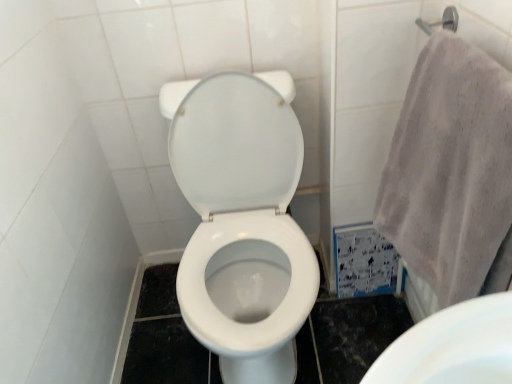
In order to click on gray cotton towel at right in this screenshot , I will do `click(451, 175)`.

This screenshot has width=512, height=384. Describe the element at coordinates (451, 175) in the screenshot. I see `gray cotton towel at right` at that location.

Identify the location of white glossy toilet at center. (242, 221).

The height and width of the screenshot is (384, 512). Describe the element at coordinates (242, 221) in the screenshot. I see `white glossy toilet at center` at that location.

Identify the location of gray cotton towel at right. This screenshot has height=384, width=512. (451, 175).

Considering the relative positions of gray cotton towel at right and white glossy toilet at center in the image provided, is gray cotton towel at right to the left or to the right of white glossy toilet at center?

gray cotton towel at right is positioned on white glossy toilet at center's right side.

Which object is further away from the camera taking this photo, gray cotton towel at right or white glossy toilet at center?

white glossy toilet at center is more distant.

Is point (496, 104) closer or farther from the camera than point (272, 272)?

Point (496, 104) appears to be closer to the viewer than point (272, 272).

From the image's perspective, is gray cotton towel at right located beneath white glossy toilet at center?

Incorrect, from the image's perspective, gray cotton towel at right is higher than white glossy toilet at center.

From a real-world perspective, is gray cotton towel at right located beneath white glossy toilet at center?

Incorrect, from a real-world perspective, gray cotton towel at right is higher than white glossy toilet at center.

Between gray cotton towel at right and white glossy toilet at center, which one has smaller width?

With smaller width is gray cotton towel at right.

Between gray cotton towel at right and white glossy toilet at center, which one has more height?

With more height is white glossy toilet at center.

Who is bigger, gray cotton towel at right or white glossy toilet at center?

white glossy toilet at center.

Which is correct: gray cotton towel at right is inside white glossy toilet at center, or outside of it?

gray cotton towel at right is spatially situated outside white glossy toilet at center.

Does gray cotton towel at right touch white glossy toilet at center?

No.

Could you tell me if gray cotton towel at right is facing white glossy toilet at center?

Yes, gray cotton towel at right is oriented towards white glossy toilet at center.

Can you tell me how much gray cotton towel at right and white glossy toilet at center differ in facing direction?

They differ by 89.5 degrees in their facing directions.

How much distance is there between gray cotton towel at right and white glossy toilet at center?

gray cotton towel at right is 15.87 inches from white glossy toilet at center.

Where is `bath towel above the white glossy toilet at center (from a real-world perspective)`? This screenshot has height=384, width=512. bath towel above the white glossy toilet at center (from a real-world perspective) is located at coordinates (451, 175).

Which is more to the right, white glossy toilet at center or gray cotton towel at right?

gray cotton towel at right is more to the right.

Who is more distant, white glossy toilet at center or gray cotton towel at right?

white glossy toilet at center is further from the camera.

Does point (258, 126) lie behind point (426, 83)?

Yes, it is behind point (426, 83).

From the image's perspective, is white glossy toilet at center below gray cotton towel at right?

Yes, from the image's perspective, white glossy toilet at center is below gray cotton towel at right.

From a real-world perspective, who is located higher, white glossy toilet at center or gray cotton towel at right?

gray cotton towel at right.

Between white glossy toilet at center and gray cotton towel at right, which one has smaller width?

gray cotton towel at right is thinner.

Is white glossy toilet at center shorter than gray cotton towel at right?

In fact, white glossy toilet at center may be taller than gray cotton towel at right.

Can you confirm if white glossy toilet at center is smaller than gray cotton towel at right?

Actually, white glossy toilet at center might be larger than gray cotton towel at right.

Consider the image. Is white glossy toilet at center outside of gray cotton towel at right?

Yes.

Is white glossy toilet at center next to gray cotton towel at right and touching it?

They are not placed beside each other.

Could you tell me if white glossy toilet at center is facing gray cotton towel at right?

No, white glossy toilet at center is not aimed at gray cotton towel at right.

How distant is white glossy toilet at center from gray cotton towel at right?

The distance of white glossy toilet at center from gray cotton towel at right is 15.87 inches.

You are a GUI agent. You are given a task and a screenshot of the screen. Output one action in this format:
    pyautogui.click(x=<x>, y=<y>)
    Task: Click on the toilet below the gray cotton towel at right (from a real-world perspective)
    This screenshot has height=384, width=512.
    Given the screenshot: What is the action you would take?
    pyautogui.click(x=242, y=221)

Locate an element on the screen. The height and width of the screenshot is (384, 512). toilet below the gray cotton towel at right (from the image's perspective) is located at coordinates (242, 221).

Locate an element on the screen. The image size is (512, 384). bath towel on the right of white glossy toilet at center is located at coordinates (451, 175).